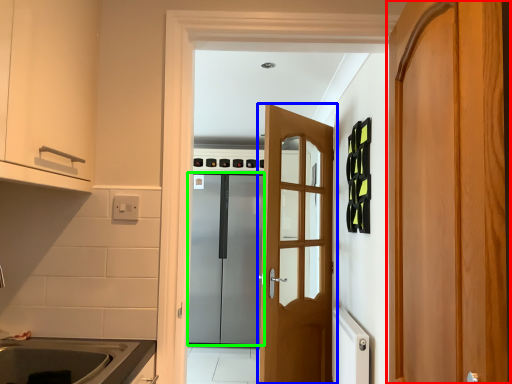
Question: Considering the real-world distances, which object is farthest from door (highlighted by a red box)? door (highlighted by a blue box) or door (highlighted by a green box)?

Choices:
 (A) door
 (B) door

Answer: (B)